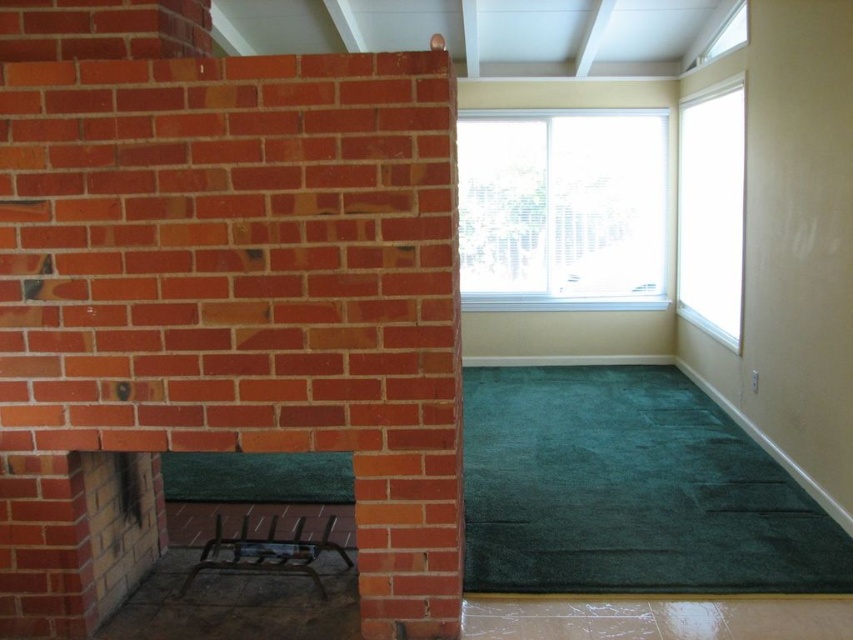
Can you confirm if clear glass window at upper center is thinner than transparent glass window at upper right?

No, clear glass window at upper center is not thinner than transparent glass window at upper right.

Image resolution: width=853 pixels, height=640 pixels. I want to click on clear glass window at upper center, so (x=563, y=209).

Is point (625, 307) farther from viewer compared to point (727, 312)?

Yes, it is.

Where is `clear glass window at upper center`? The width and height of the screenshot is (853, 640). clear glass window at upper center is located at coordinates (563, 209).

Can you confirm if clear glass window at upper center is thinner than metallic grate at lower left?

Incorrect, clear glass window at upper center's width is not less than metallic grate at lower left's.

Can you confirm if clear glass window at upper center is shorter than metallic grate at lower left?

Incorrect, clear glass window at upper center's height does not fall short of metallic grate at lower left's.

Is point (606, 292) positioned after point (105, 465)?

Yes.

Find the location of a particular element. Image resolution: width=853 pixels, height=640 pixels. clear glass window at upper center is located at coordinates (563, 209).

Is point (297, 596) in front of point (733, 106)?

Yes, point (297, 596) is closer to viewer.

Which is in front, point (167, 595) or point (738, 134)?

Point (167, 595) is in front.

Is point (271, 573) in front of point (697, 264)?

Yes, point (271, 573) is closer to viewer.

Where is `metallic grate at lower left`? metallic grate at lower left is located at coordinates (209, 570).